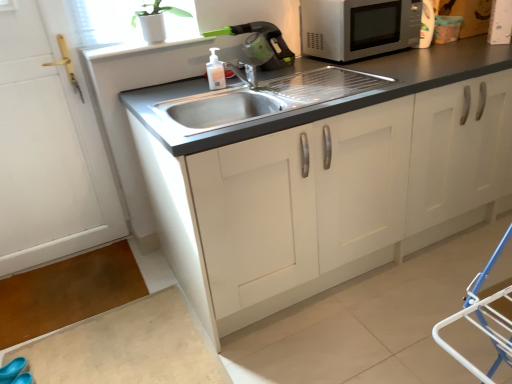
Find the location of a particular element. The image size is (512, 384). vacant space underneath white matte door at left (from a real-world perspective) is located at coordinates (74, 250).